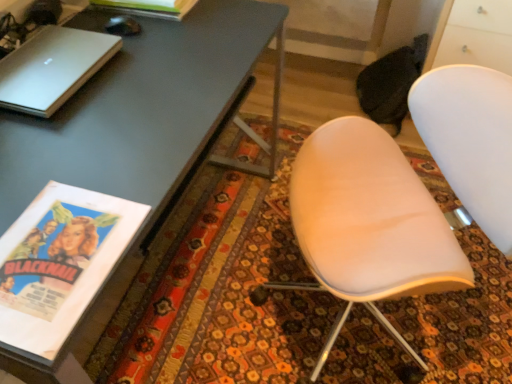
Image resolution: width=512 pixels, height=384 pixels. What are the coordinates of `free spot to the right of matte paper magazine at upper left` in the screenshot? It's located at (223, 20).